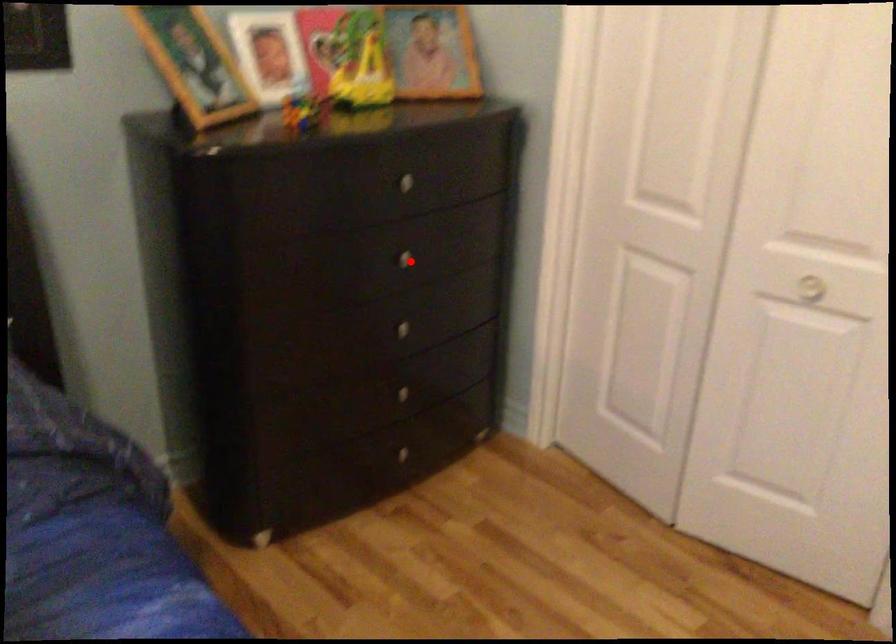
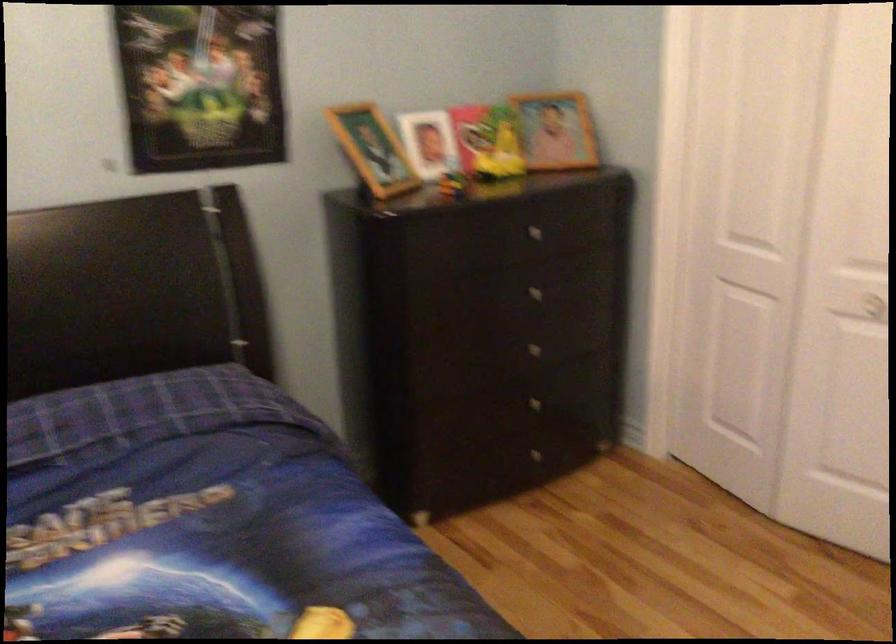
The point at the highlighted location is marked in the first image. Where is the corresponding point in the second image?

(538, 292)